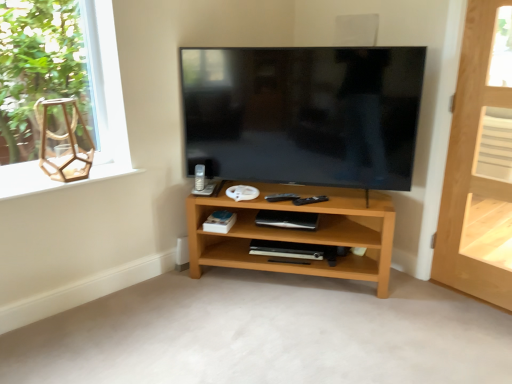
Question: Is matte black tv at center at the left side of white matte speaker at upper center?

Choices:
 (A) no
 (B) yes

Answer: (B)

Question: Is matte black tv at center positioned in front of white matte speaker at upper center?

Choices:
 (A) no
 (B) yes

Answer: (B)

Question: From the image's perspective, is matte black tv at center under white matte speaker at upper center?

Choices:
 (A) yes
 (B) no

Answer: (A)

Question: From the image's perspective, would you say matte black tv at center is positioned over white matte speaker at upper center?

Choices:
 (A) no
 (B) yes

Answer: (A)

Question: From a real-world perspective, does matte black tv at center sit lower than white matte speaker at upper center?

Choices:
 (A) yes
 (B) no

Answer: (A)

Question: Considering the relative positions of matte black tv at center and white matte speaker at upper center in the image provided, is matte black tv at center to the right of white matte speaker at upper center from the viewer's perspective?

Choices:
 (A) no
 (B) yes

Answer: (A)

Question: Is light brown wooden door at right wider than white matte shelf at right, the second shelf positioned from the bottom?

Choices:
 (A) yes
 (B) no

Answer: (B)

Question: From a real-world perspective, is light brown wooden door at right below white matte shelf at right, the second shelf when ordered from front to back?

Choices:
 (A) yes
 (B) no

Answer: (B)

Question: Is light brown wooden door at right taller than white matte shelf at right, which appears as the 1th shelf when viewed from the top?

Choices:
 (A) yes
 (B) no

Answer: (A)

Question: Is light brown wooden door at right facing towards white matte shelf at right, the second shelf positioned from the bottom?

Choices:
 (A) no
 (B) yes

Answer: (A)

Question: Considering the relative sizes of light brown wooden door at right and white matte shelf at right, which is counted as the 1th shelf, starting from the back, in the image provided, is light brown wooden door at right thinner than white matte shelf at right, which is counted as the 1th shelf, starting from the back,?

Choices:
 (A) no
 (B) yes

Answer: (B)

Question: Is light brown wooden door at right oriented away from white matte shelf at right, the second shelf positioned from the bottom?

Choices:
 (A) no
 (B) yes

Answer: (A)

Question: From the image's perspective, would you say light brown wood shelf at center, placed as the second shelf when sorted from back to front, is positioned over wooden hexagon at upper left?

Choices:
 (A) yes
 (B) no

Answer: (B)